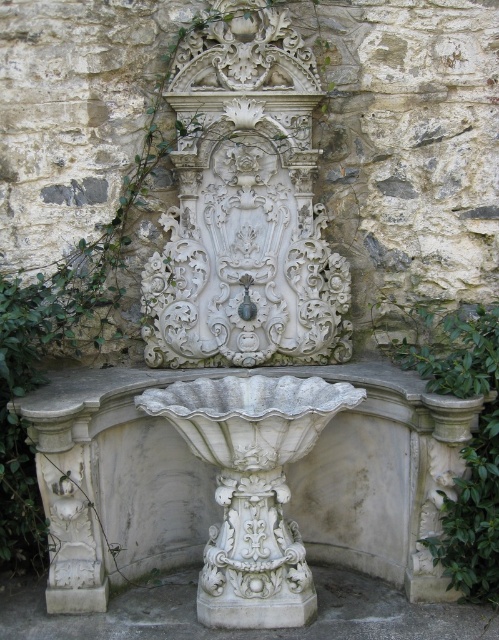
Question: Which point appears farthest from the camera in this image?

Choices:
 (A) (493, 408)
 (B) (424, 611)

Answer: (B)

Question: Can you confirm if white stone pedestal at center is positioned to the right of green leafy ivy at right?

Choices:
 (A) yes
 (B) no

Answer: (B)

Question: From the image, what is the correct spatial relationship of white stone pedestal at center in relation to green leafy ivy at right?

Choices:
 (A) right
 (B) left

Answer: (B)

Question: Can you confirm if white stone pedestal at center is positioned below green leafy ivy at right?

Choices:
 (A) no
 (B) yes

Answer: (B)